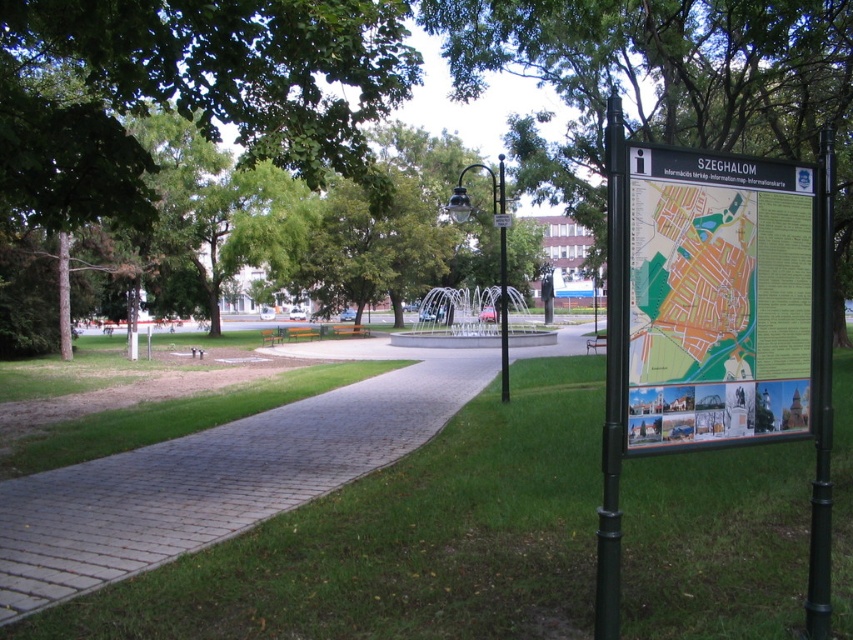
Is point (358, 449) less distant than point (500, 243)?

That is True.

Between point (325, 474) and point (498, 156), which one is positioned behind?

The point (498, 156) is more distant.

Who is more distant from viewer, (161, 522) or (502, 182)?

The point (502, 182) is behind.

I want to click on paved stone path at center, so click(221, 474).

Who is taller, green leafy tree at center or paved stone path at center?

green leafy tree at center is taller.

This screenshot has width=853, height=640. I want to click on green leafy tree at center, so click(x=664, y=84).

This screenshot has width=853, height=640. Describe the element at coordinates (664, 84) in the screenshot. I see `green leafy tree at center` at that location.

Locate an element on the screen. The width and height of the screenshot is (853, 640). green leafy tree at center is located at coordinates (664, 84).

Does black metal pole at right appear over black metal signpost at right?

Correct, black metal pole at right is located above black metal signpost at right.

Can you confirm if black metal pole at right is shorter than black metal signpost at right?

In fact, black metal pole at right may be taller than black metal signpost at right.

Does point (605, 460) lie behind point (824, 209)?

No.

This screenshot has width=853, height=640. In order to click on black metal pole at right in this screenshot , I will do `click(612, 376)`.